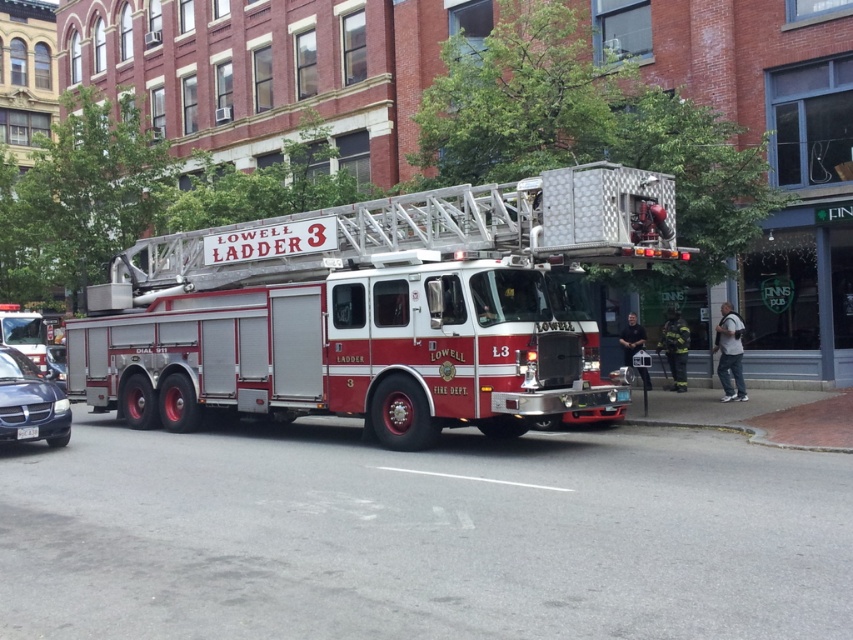
You are standing at the origin point of the image. Where is the metallic silver fire truck at left located in terms of coordinates?

The metallic silver fire truck at left is located at coordinates point (28, 337).

You are a pedestrian standing on the sidewalk and see the red metallic fire truck at center and the metallic blue sedan at lower left. Which vehicle is closer to you?

The red metallic fire truck at center is closer to you because it is positioned over the metallic blue sedan at lower left, indicating it is in front of it from your viewpoint.